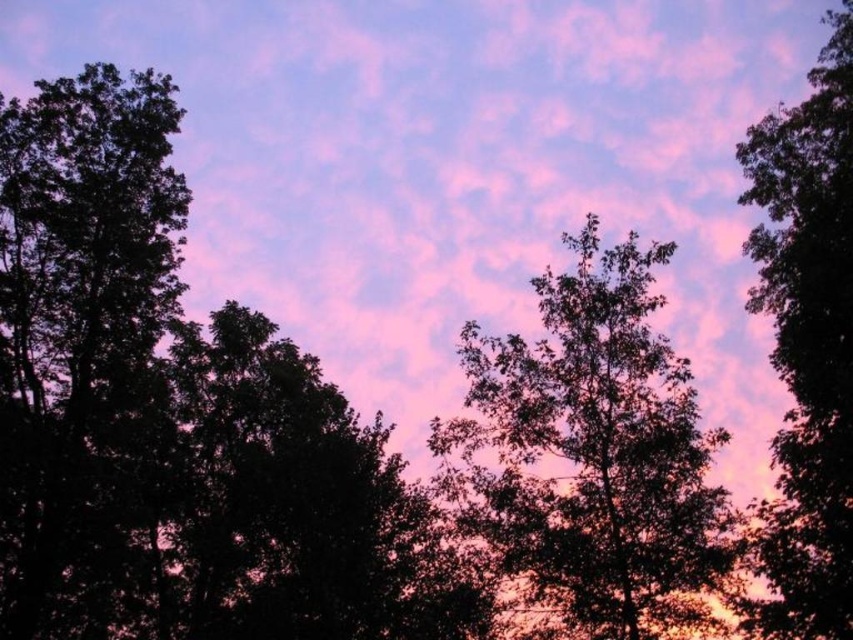
What do you see at coordinates (593, 456) in the screenshot? The image size is (853, 640). I see `green leafy tree at center` at bounding box center [593, 456].

Who is positioned more to the right, green leafy tree at center or silhouette leafy tree at right?

silhouette leafy tree at right

Describe the element at coordinates (593, 456) in the screenshot. The height and width of the screenshot is (640, 853). I see `green leafy tree at center` at that location.

Where is `green leafy tree at center`? green leafy tree at center is located at coordinates (593, 456).